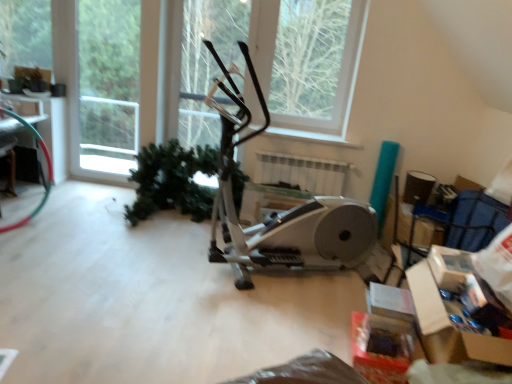
Locate an element on the screen. This screenshot has height=384, width=512. vacant point above white plastic radiator at center (from a real-world perspective) is located at coordinates (303, 152).